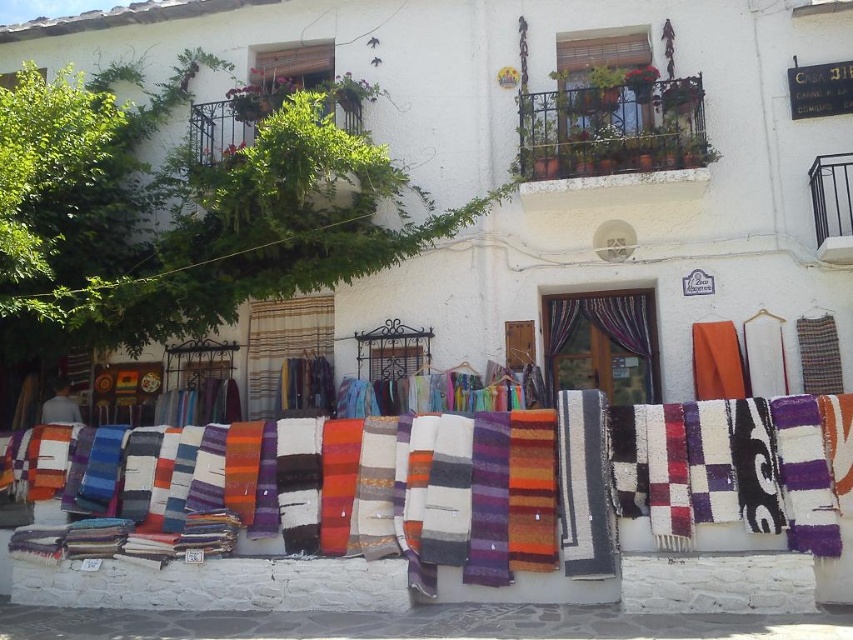
You are a traveler who wants to buy a fabric item that can be used as a wall hanging. You see the multicolored woven curtain at center and the striped fabric at center. Which one is bigger and more suitable for a wall hanging?

The multicolored woven curtain at center has a larger size compared to the striped fabric at center, making it more suitable for a wall hanging.

You are a traveler who wants to buy a fabric that can cover a large window. You see the multicolored woven curtain at center and the striped fabric at center. Which one should you choose?

The multicolored woven curtain at center has a larger width than the striped fabric at center, so it is better for covering a large window.